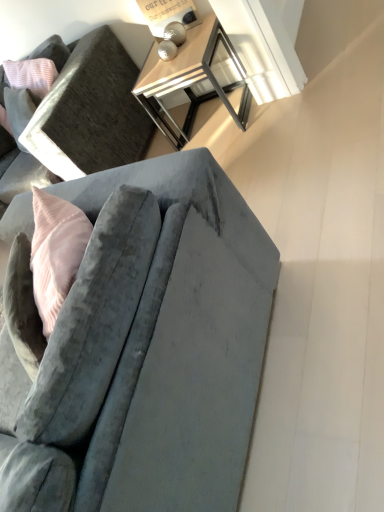
Question: Is velvet gray couch at lower left, arranged as the 1th studio couch when viewed from the back, positioned with its back to metallic silver table lamp at upper center?

Choices:
 (A) yes
 (B) no

Answer: (B)

Question: Does velvet gray couch at lower left, the 2th studio couch in the bottom-to-top sequence, have a lesser height compared to metallic silver table lamp at upper center?

Choices:
 (A) no
 (B) yes

Answer: (A)

Question: Is velvet gray couch at lower left, arranged as the 1th studio couch when viewed from the top, not near metallic silver table lamp at upper center?

Choices:
 (A) yes
 (B) no

Answer: (B)

Question: Is velvet gray couch at lower left, arranged as the 1th studio couch when viewed from the top, in contact with metallic silver table lamp at upper center?

Choices:
 (A) yes
 (B) no

Answer: (B)

Question: Considering the relative sizes of velvet gray couch at lower left, arranged as the 1th studio couch when viewed from the top, and metallic silver table lamp at upper center in the image provided, is velvet gray couch at lower left, arranged as the 1th studio couch when viewed from the top, thinner than metallic silver table lamp at upper center?

Choices:
 (A) no
 (B) yes

Answer: (A)

Question: Is point (99, 136) positioned closer to the camera than point (173, 282)?

Choices:
 (A) closer
 (B) farther

Answer: (B)

Question: Looking at the image, does velvet gray couch at lower left, arranged as the 1th studio couch when viewed from the top, seem bigger or smaller compared to velvet gray couch at center, the first studio couch when ordered from front to back?

Choices:
 (A) big
 (B) small

Answer: (A)

Question: Is velvet gray couch at lower left, arranged as the 1th studio couch when viewed from the top, wider or thinner than velvet gray couch at center, the second studio couch in the back-to-front sequence?

Choices:
 (A) thin
 (B) wide

Answer: (A)

Question: Is velvet gray couch at lower left, arranged as the 1th studio couch when viewed from the back, spatially inside velvet gray couch at center, the second studio couch viewed from the top, or outside of it?

Choices:
 (A) inside
 (B) outside

Answer: (B)

Question: Would you say metallic silver table lamp at upper center is to the left or to the right of velvet gray couch at lower left, arranged as the 1th studio couch when viewed from the top, in the picture?

Choices:
 (A) right
 (B) left

Answer: (A)

Question: In terms of width, does metallic silver table lamp at upper center look wider or thinner when compared to velvet gray couch at lower left, arranged as the 1th studio couch when viewed from the top?

Choices:
 (A) wide
 (B) thin

Answer: (B)

Question: Considering their positions, is metallic silver table lamp at upper center located in front of or behind velvet gray couch at lower left, which is counted as the 2th studio couch, starting from the front?

Choices:
 (A) front
 (B) behind

Answer: (B)

Question: Is point (185, 19) positioned closer to the camera than point (132, 147)?

Choices:
 (A) farther
 (B) closer

Answer: (B)

Question: From their relative heights in the image, would you say velvet gray couch at center, the second studio couch viewed from the top, is taller or shorter than metallic silver table lamp at upper center?

Choices:
 (A) tall
 (B) short

Answer: (A)

Question: From a real-world perspective, relative to metallic silver table lamp at upper center, is velvet gray couch at center, the 1th studio couch in the bottom-to-top sequence, vertically above or below?

Choices:
 (A) above
 (B) below

Answer: (B)